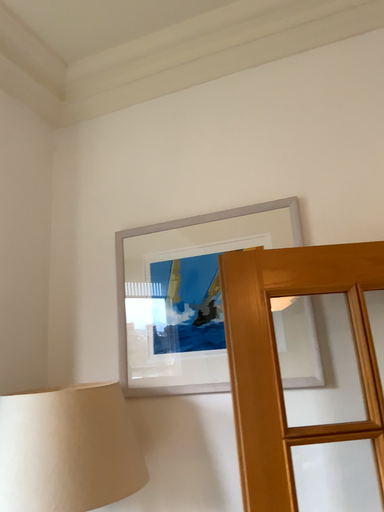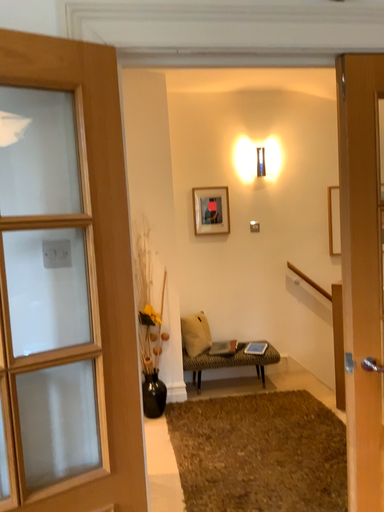
Question: Which way did the camera rotate in the video?

Choices:
 (A) rotated upward
 (B) rotated downward

Answer: (B)